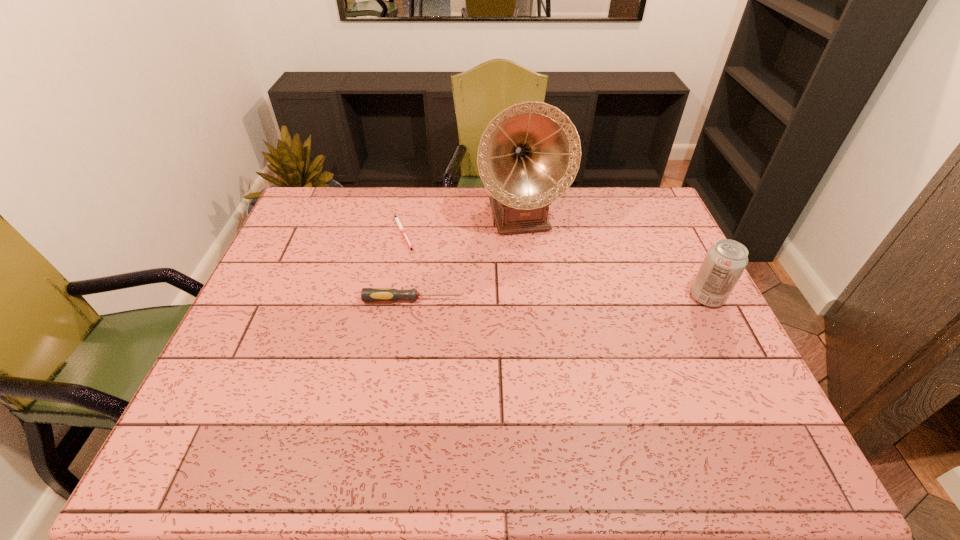
Where is `screwdriver`? The image size is (960, 540). screwdriver is located at coordinates (367, 294).

The image size is (960, 540). I want to click on the rightmost object, so click(x=725, y=261).

At what (x,y) coordinates should I click in order to perform the action: click on soda can. Please return your answer as a coordinate pair (x, y). The image size is (960, 540). Looking at the image, I should click on (725, 261).

Find the location of a particular element. phonograph record is located at coordinates (528, 156).

Find the location of `the second object from right to left`. the second object from right to left is located at coordinates 528,156.

Locate an element on the screen. The width and height of the screenshot is (960, 540). pen is located at coordinates (396, 218).

Where is `free space located 0.180m insert the screwdriver into a screw head`? free space located 0.180m insert the screwdriver into a screw head is located at coordinates (527, 300).

Locate an element on the screen. Image resolution: width=960 pixels, height=540 pixels. vacant point located 0.240m on the front of the second tallest object is located at coordinates [x=753, y=387].

You are a GUI agent. You are given a task and a screenshot of the screen. Output one action in this format:
    pyautogui.click(x=<x>, y=<y>)
    Task: Click on the vacant space located 0.340m on the horn of the tallest object
    
    Given the screenshot: What is the action you would take?
    pyautogui.click(x=560, y=323)

Find the location of `free location located on the horn of the tallest object`. free location located on the horn of the tallest object is located at coordinates (556, 312).